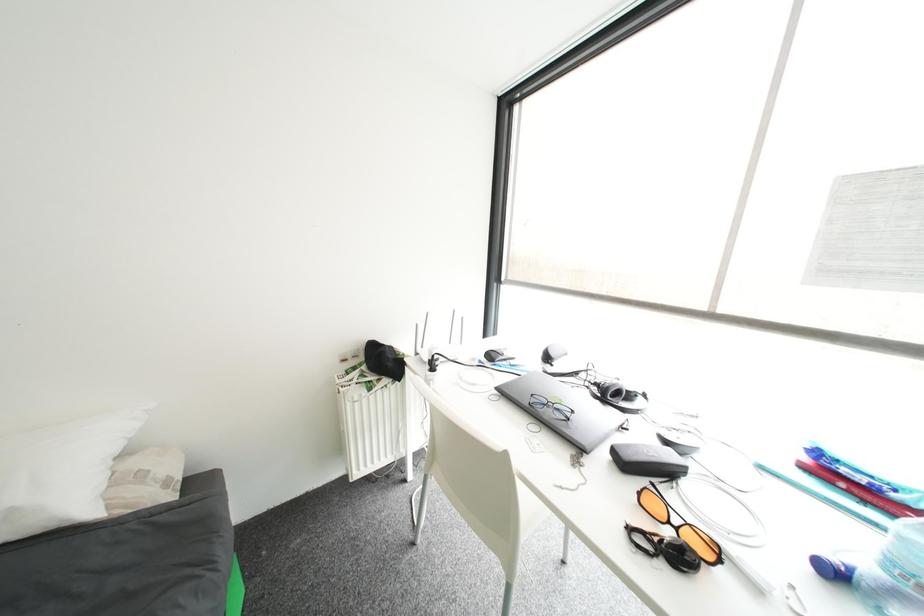
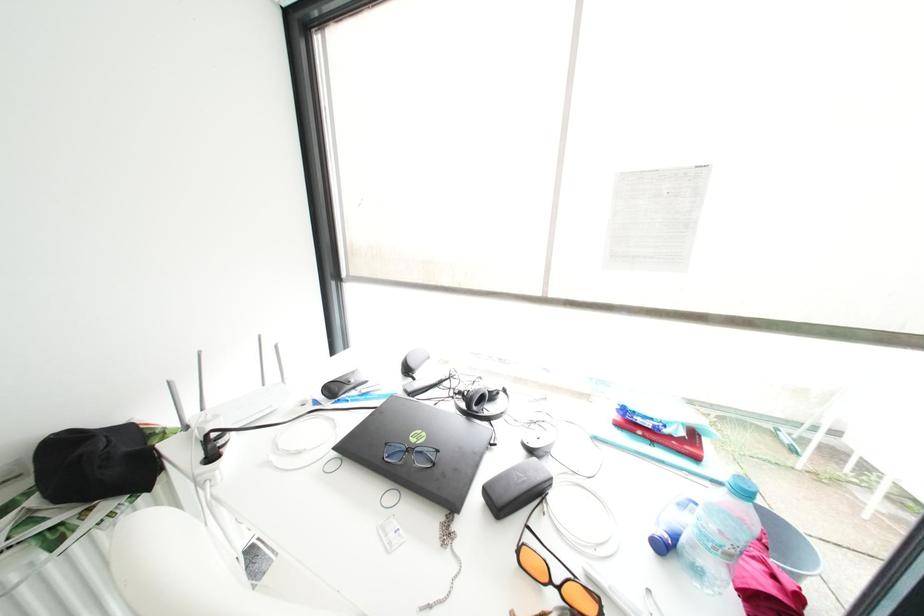
Question: The images are taken continuously from a first-person perspective. In which direction is your viewpoint rotating?

Choices:
 (A) Left
 (B) Right
 (C) Up
 (D) Down

Answer: (B)